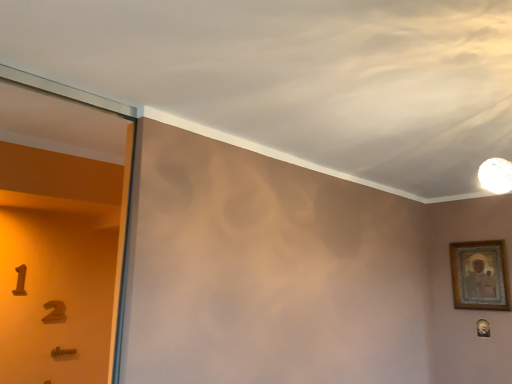
The width and height of the screenshot is (512, 384). What are the coordinates of `gold-framed painting at right, the first picture frame from the top` in the screenshot? It's located at (480, 275).

What is the approximate width of gold-framed painting at right, which appears as the 2th picture frame when ordered from the bottom?

The width of gold-framed painting at right, which appears as the 2th picture frame when ordered from the bottom, is 1.70 inches.

What do you see at coordinates (480, 275) in the screenshot?
I see `gold-framed painting at right, the first picture frame from the top` at bounding box center [480, 275].

The height and width of the screenshot is (384, 512). I want to click on gold-framed portrait at lower right, arranged as the 1th picture frame when ordered from the bottom, so click(x=483, y=328).

Describe the element at coordinates (483, 328) in the screenshot. I see `gold-framed portrait at lower right, arranged as the 1th picture frame when ordered from the bottom` at that location.

I want to click on gold-framed painting at right, which appears as the 2th picture frame when ordered from the bottom, so click(x=480, y=275).

Consider the image. Would you say gold-framed portrait at lower right, arranged as the 1th picture frame when ordered from the bottom, is to the left or to the right of gold-framed painting at right, which appears as the 2th picture frame when ordered from the bottom, in the picture?

gold-framed portrait at lower right, arranged as the 1th picture frame when ordered from the bottom, is to the right of gold-framed painting at right, which appears as the 2th picture frame when ordered from the bottom.

Which object is closer to the camera, gold-framed portrait at lower right, placed as the 2th picture frame when sorted from top to bottom, or gold-framed painting at right, which appears as the 2th picture frame when ordered from the bottom?

gold-framed painting at right, which appears as the 2th picture frame when ordered from the bottom, is in front.

Is point (489, 327) behind point (453, 274)?

No, it is not.

From the image's perspective, which one is positioned lower, gold-framed portrait at lower right, arranged as the 1th picture frame when ordered from the bottom, or gold-framed painting at right, the first picture frame from the top?

gold-framed portrait at lower right, arranged as the 1th picture frame when ordered from the bottom.

From a real-world perspective, which is physically below, gold-framed portrait at lower right, arranged as the 1th picture frame when ordered from the bottom, or gold-framed painting at right, the first picture frame from the top?

From a 3D spatial view, gold-framed portrait at lower right, arranged as the 1th picture frame when ordered from the bottom, is below.

Is gold-framed portrait at lower right, arranged as the 1th picture frame when ordered from the bottom, wider or thinner than gold-framed painting at right, the first picture frame from the top?

Considering their sizes, gold-framed portrait at lower right, arranged as the 1th picture frame when ordered from the bottom, looks slimmer than gold-framed painting at right, the first picture frame from the top.

Which of these two, gold-framed portrait at lower right, arranged as the 1th picture frame when ordered from the bottom, or gold-framed painting at right, the first picture frame from the top, stands taller?

With more height is gold-framed painting at right, the first picture frame from the top.

Considering the relative sizes of gold-framed portrait at lower right, arranged as the 1th picture frame when ordered from the bottom, and gold-framed painting at right, the first picture frame from the top, in the image provided, is gold-framed portrait at lower right, arranged as the 1th picture frame when ordered from the bottom, smaller than gold-framed painting at right, the first picture frame from the top,?

Indeed, gold-framed portrait at lower right, arranged as the 1th picture frame when ordered from the bottom, has a smaller size compared to gold-framed painting at right, the first picture frame from the top.

Is gold-framed portrait at lower right, placed as the 2th picture frame when sorted from top to bottom, inside the boundaries of gold-framed painting at right, which appears as the 2th picture frame when ordered from the bottom, or outside?

gold-framed portrait at lower right, placed as the 2th picture frame when sorted from top to bottom, cannot be found inside gold-framed painting at right, which appears as the 2th picture frame when ordered from the bottom.

Is gold-framed portrait at lower right, arranged as the 1th picture frame when ordered from the bottom, in contact with gold-framed painting at right, which appears as the 2th picture frame when ordered from the bottom?

gold-framed portrait at lower right, arranged as the 1th picture frame when ordered from the bottom, and gold-framed painting at right, which appears as the 2th picture frame when ordered from the bottom, are clearly separated.

Is gold-framed portrait at lower right, arranged as the 1th picture frame when ordered from the bottom, facing away from gold-framed painting at right, the first picture frame from the top?

No, gold-framed portrait at lower right, arranged as the 1th picture frame when ordered from the bottom, is not facing the opposite direction of gold-framed painting at right, the first picture frame from the top.

Can you tell me how much gold-framed portrait at lower right, placed as the 2th picture frame when sorted from top to bottom, and gold-framed painting at right, which appears as the 2th picture frame when ordered from the bottom, differ in facing direction?

The angular difference between gold-framed portrait at lower right, placed as the 2th picture frame when sorted from top to bottom, and gold-framed painting at right, which appears as the 2th picture frame when ordered from the bottom, is 1.31 degrees.

How far apart are gold-framed portrait at lower right, placed as the 2th picture frame when sorted from top to bottom, and gold-framed painting at right, which appears as the 2th picture frame when ordered from the bottom?

They are 11.88 inches apart.

Image resolution: width=512 pixels, height=384 pixels. In order to click on picture frame that appears behind the gold-framed painting at right, the first picture frame from the top in this screenshot , I will do `click(483, 328)`.

Is gold-framed painting at right, the first picture frame from the top, at the left side of gold-framed portrait at lower right, arranged as the 1th picture frame when ordered from the bottom?

Yes, gold-framed painting at right, the first picture frame from the top, is to the left of gold-framed portrait at lower right, arranged as the 1th picture frame when ordered from the bottom.

Is gold-framed painting at right, the first picture frame from the top, positioned before gold-framed portrait at lower right, arranged as the 1th picture frame when ordered from the bottom?

Yes, gold-framed painting at right, the first picture frame from the top, is closer to the viewer.

Does point (475, 259) appear closer or farther from the camera than point (487, 336)?

Point (475, 259) is farther from the camera than point (487, 336).

From the image's perspective, which is above, gold-framed painting at right, the first picture frame from the top, or gold-framed portrait at lower right, placed as the 2th picture frame when sorted from top to bottom?

From the image's view, gold-framed painting at right, the first picture frame from the top, is above.

From a real-world perspective, is gold-framed painting at right, the first picture frame from the top, on top of gold-framed portrait at lower right, arranged as the 1th picture frame when ordered from the bottom?

Yes.

Is gold-framed painting at right, which appears as the 2th picture frame when ordered from the bottom, wider or thinner than gold-framed portrait at lower right, placed as the 2th picture frame when sorted from top to bottom?

Clearly, gold-framed painting at right, which appears as the 2th picture frame when ordered from the bottom, has more width compared to gold-framed portrait at lower right, placed as the 2th picture frame when sorted from top to bottom.

Is gold-framed painting at right, the first picture frame from the top, taller than gold-framed portrait at lower right, placed as the 2th picture frame when sorted from top to bottom?

Yes.

Between gold-framed painting at right, which appears as the 2th picture frame when ordered from the bottom, and gold-framed portrait at lower right, placed as the 2th picture frame when sorted from top to bottom, which one has smaller size?

With smaller size is gold-framed portrait at lower right, placed as the 2th picture frame when sorted from top to bottom.

Looking at this image, choose the correct answer: Is gold-framed painting at right, the first picture frame from the top, inside gold-framed portrait at lower right, arranged as the 1th picture frame when ordered from the bottom, or outside it?

The correct answer is: outside.

Is gold-framed painting at right, which appears as the 2th picture frame when ordered from the bottom, in contact with gold-framed portrait at lower right, arranged as the 1th picture frame when ordered from the bottom?

No, gold-framed painting at right, which appears as the 2th picture frame when ordered from the bottom, is not next to gold-framed portrait at lower right, arranged as the 1th picture frame when ordered from the bottom.

Is gold-framed painting at right, the first picture frame from the top, turned away from gold-framed portrait at lower right, arranged as the 1th picture frame when ordered from the bottom?

gold-framed painting at right, the first picture frame from the top, does not have its back to gold-framed portrait at lower right, arranged as the 1th picture frame when ordered from the bottom.

How different are the orientations of gold-framed painting at right, the first picture frame from the top, and gold-framed portrait at lower right, placed as the 2th picture frame when sorted from top to bottom, in degrees?

The facing directions of gold-framed painting at right, the first picture frame from the top, and gold-framed portrait at lower right, placed as the 2th picture frame when sorted from top to bottom, are 1.31 degrees apart.

Find the location of a particular element. The image size is (512, 384). picture frame on the left side of gold-framed portrait at lower right, placed as the 2th picture frame when sorted from top to bottom is located at coordinates (480, 275).

At what (x,y) coordinates should I click in order to perform the action: click on picture frame above the gold-framed portrait at lower right, arranged as the 1th picture frame when ordered from the bottom (from a real-world perspective). Please return your answer as a coordinate pair (x, y). Looking at the image, I should click on (480, 275).

Find the location of a particular element. The height and width of the screenshot is (384, 512). picture frame that is on the right side of gold-framed painting at right, the first picture frame from the top is located at coordinates (483, 328).